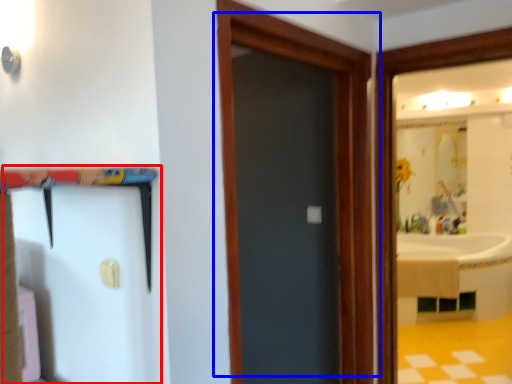
Question: Which object appears farthest to the camera in this image, barn door (highlighted by a red box) or door (highlighted by a blue box)?

Choices:
 (A) barn door
 (B) door

Answer: (B)